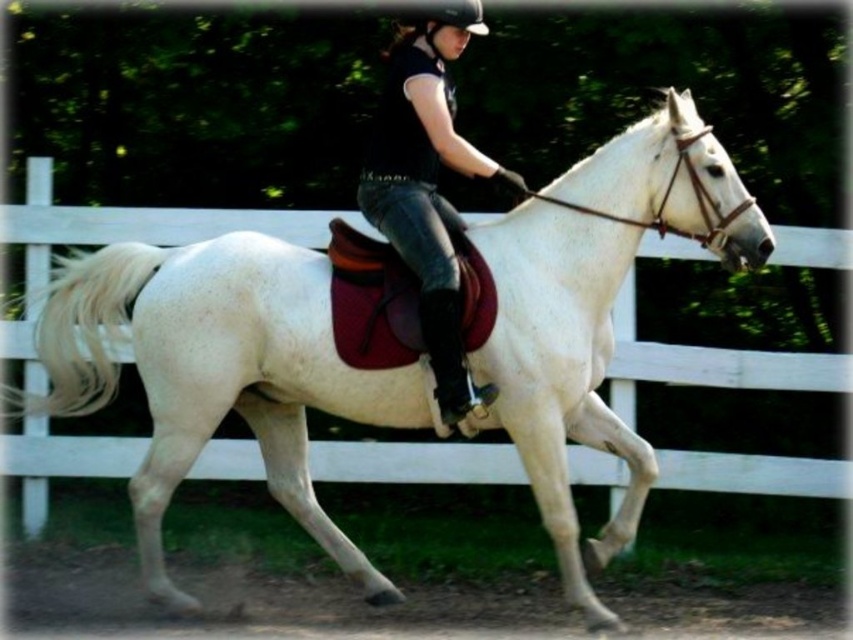
You are a photographer trying to capture a clear photo of the rider. The camera has a focus range of 20 inches. Can you focus on both the black matte shirt at center and the black hard helmet at upper center at the same time?

The black matte shirt at center and black hard helmet at upper center are 22.61 inches apart from each other. Since the camera can only focus within a 20 inch range, they cannot both be in focus at the same time.

You are a photographer trying to capture the rider on the white horse in the scene. You notice a point at coordinates (x=428, y=188) which marks the location of the black matte shirt at center. Where exactly is the black matte shirt located in relation to the rider?

The point at (x=428, y=188) marks the location of the black matte shirt at center, which is positioned at the center of the rider, likely covering their torso.

You are a photographer trying to capture the rider on the white horse. You need to focus your camera on the black matte shirt at center. What are the coordinates to aim your camera?

The coordinates to aim your camera at the black matte shirt at center are point (428, 188).